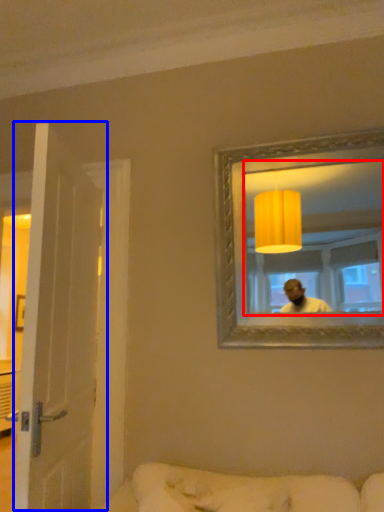
Question: Which object is closer to the camera taking this photo, mirror (highlighted by a red box) or door (highlighted by a blue box)?

Choices:
 (A) mirror
 (B) door

Answer: (A)